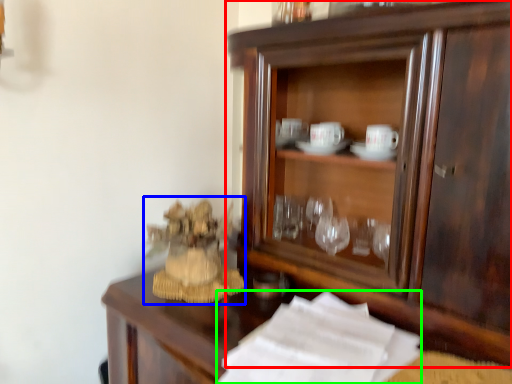
Question: Which is nearer to the cupboard (highlighted by a red box)? toy (highlighted by a blue box) or paper (highlighted by a green box).

Choices:
 (A) toy
 (B) paper

Answer: (B)